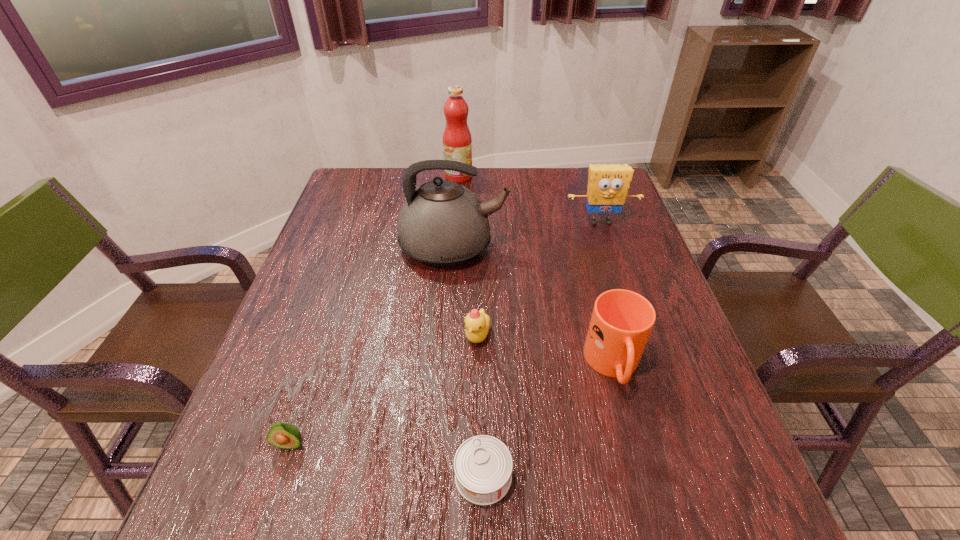
Locate an element on the screen. The width and height of the screenshot is (960, 540). the farthest object is located at coordinates (457, 141).

Where is `kettle`? This screenshot has width=960, height=540. kettle is located at coordinates (442, 223).

The height and width of the screenshot is (540, 960). In order to click on the third tallest object in this screenshot , I will do `click(608, 185)`.

Locate an element on the screen. The width and height of the screenshot is (960, 540). the fourth tallest object is located at coordinates (622, 320).

You are a GUI agent. You are given a task and a screenshot of the screen. Output one action in this format:
    pyautogui.click(x=<x>, y=<y>)
    Task: Click on the duckling
    The height and width of the screenshot is (540, 960).
    Given the screenshot: What is the action you would take?
    click(477, 323)

I want to click on avocado, so click(x=283, y=435).

Identify the location of can. (483, 465).

At what (x,y) coordinates should I click in order to perform the action: click on vacant space located on the front label of the fruit juice. Please return your answer as a coordinate pair (x, y). The height and width of the screenshot is (540, 960). Looking at the image, I should click on (524, 177).

The height and width of the screenshot is (540, 960). What are the coordinates of `vacant space situated 0.270m at the spout of the kettle` in the screenshot? It's located at (608, 247).

You are a GUI agent. You are given a task and a screenshot of the screen. Output one action in this format:
    pyautogui.click(x=<x>, y=<y>)
    Task: Click on the vacant space located 0.200m on the face of the sponge
    
    Given the screenshot: What is the action you would take?
    pyautogui.click(x=620, y=280)